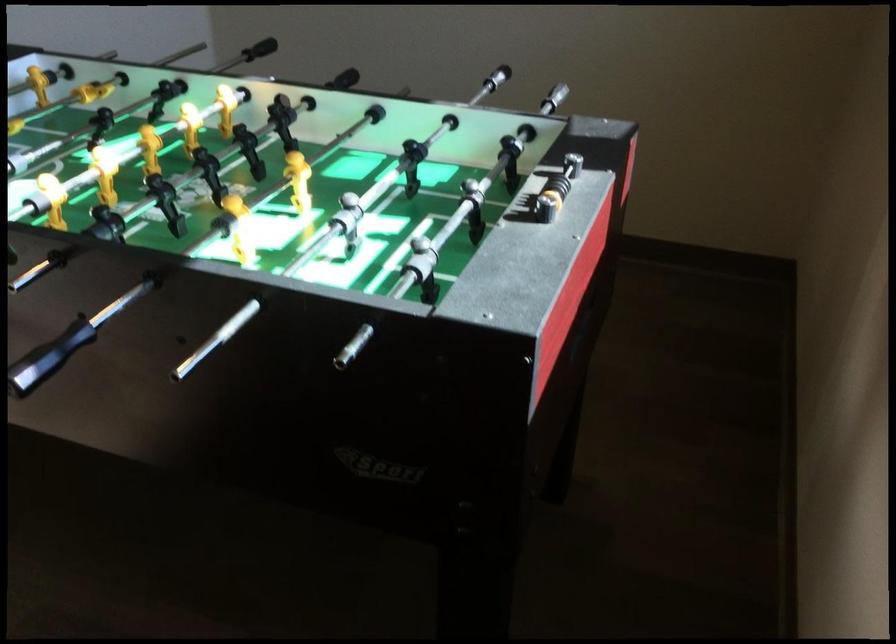
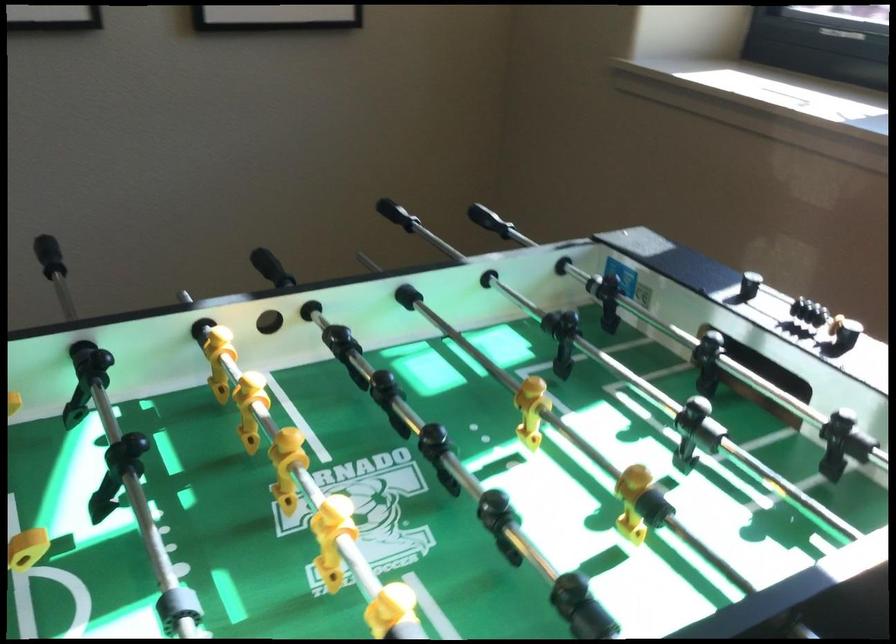
Find the pixel in the second image that matches (703,128) in the first image.

(397, 214)